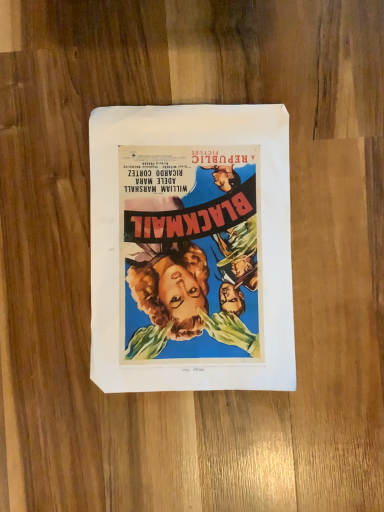
In order to click on matte paper poster at center in this screenshot , I will do `click(191, 248)`.

What do you see at coordinates (191, 248) in the screenshot? This screenshot has width=384, height=512. I see `matte paper poster at center` at bounding box center [191, 248].

Identify the location of matte paper poster at center. (191, 248).